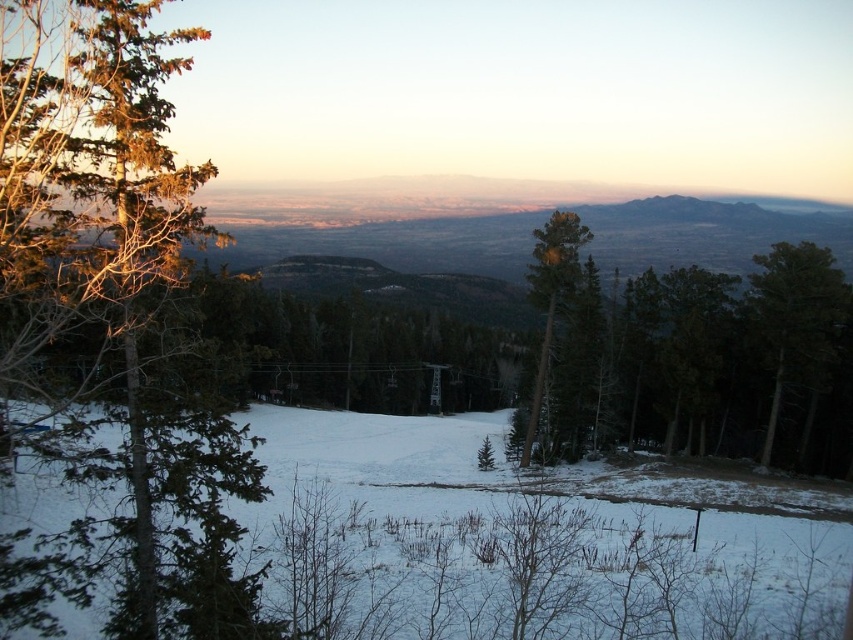
Can you confirm if green matte tree at left is smaller than white snow ski slope at center?

Correct, green matte tree at left occupies less space than white snow ski slope at center.

Who is positioned more to the left, green matte tree at left or white snow ski slope at center?

green matte tree at left is more to the left.

Is point (107, 342) behind point (448, 630)?

No.

Where is `green matte tree at left`? green matte tree at left is located at coordinates [x=109, y=326].

Is white snow ski slope at center to the right of green matte tree at right from the viewer's perspective?

No, white snow ski slope at center is not to the right of green matte tree at right.

Can you confirm if white snow ski slope at center is wider than green matte tree at right?

Indeed, white snow ski slope at center has a greater width compared to green matte tree at right.

Where is `white snow ski slope at center`? The width and height of the screenshot is (853, 640). white snow ski slope at center is located at coordinates (508, 548).

Locate an element on the screen. This screenshot has height=640, width=853. white snow ski slope at center is located at coordinates pos(508,548).

Does green matte tree at right have a greater width compared to green matte tree at center?

No.

Does green matte tree at right have a lesser height compared to green matte tree at center?

Indeed, green matte tree at right has a lesser height compared to green matte tree at center.

Between point (828, 348) and point (543, 353), which one is positioned in front?

Positioned in front is point (828, 348).

Locate an element on the screen. The width and height of the screenshot is (853, 640). green matte tree at right is located at coordinates (795, 320).